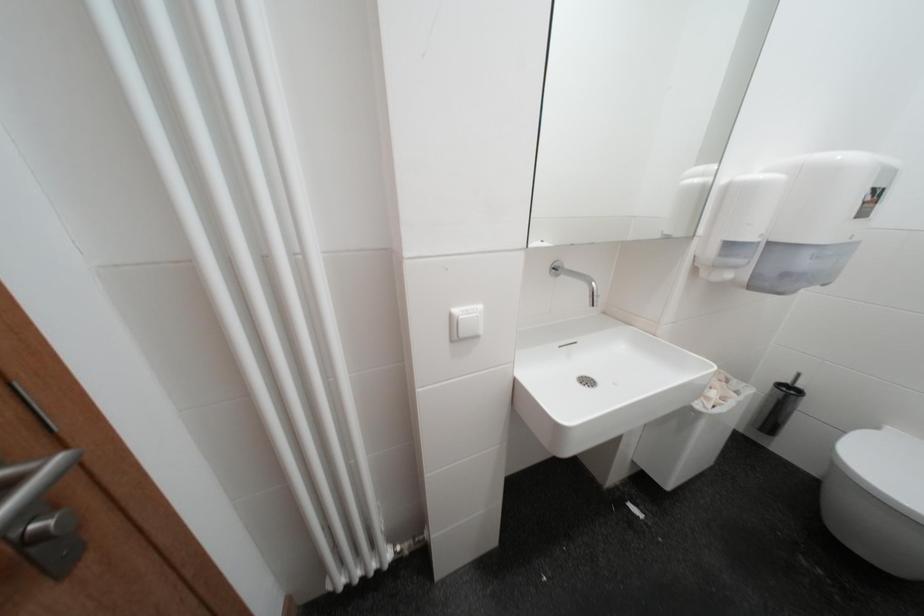
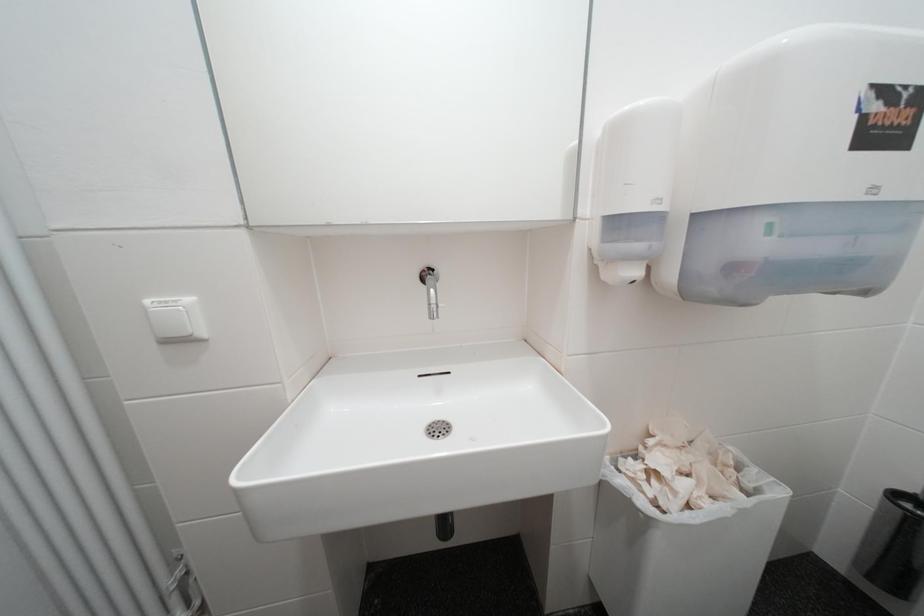
The images are taken continuously from a first-person perspective. In which direction are you moving?

The cameraman walked toward right, forward.